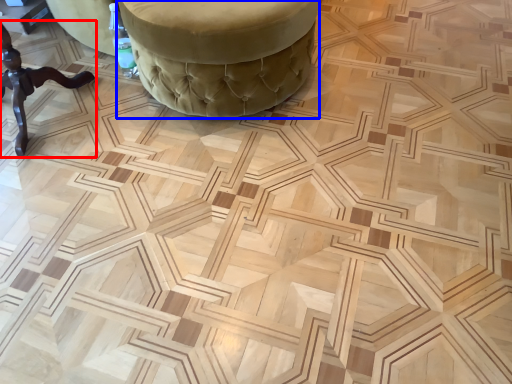
Question: Which object is further to the camera taking this photo, furniture (highlighted by a red box) or furniture (highlighted by a blue box)?

Choices:
 (A) furniture
 (B) furniture

Answer: (B)